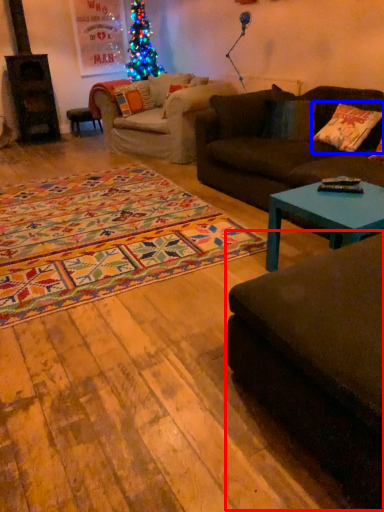
Question: Which point is further to the camera, studio couch (highlighted by a red box) or pillow (highlighted by a blue box)?

Choices:
 (A) studio couch
 (B) pillow

Answer: (B)